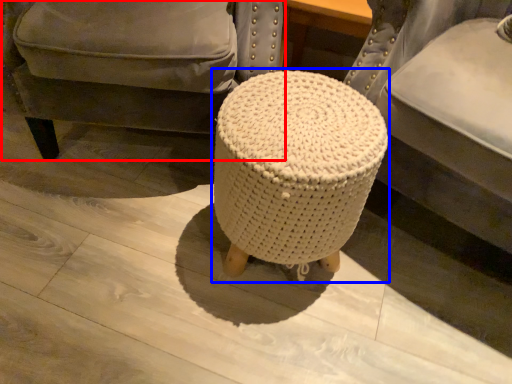
Question: Among these objects, which one is farthest to the camera, chair (highlighted by a red box) or bar stool (highlighted by a blue box)?

Choices:
 (A) chair
 (B) bar stool

Answer: (A)